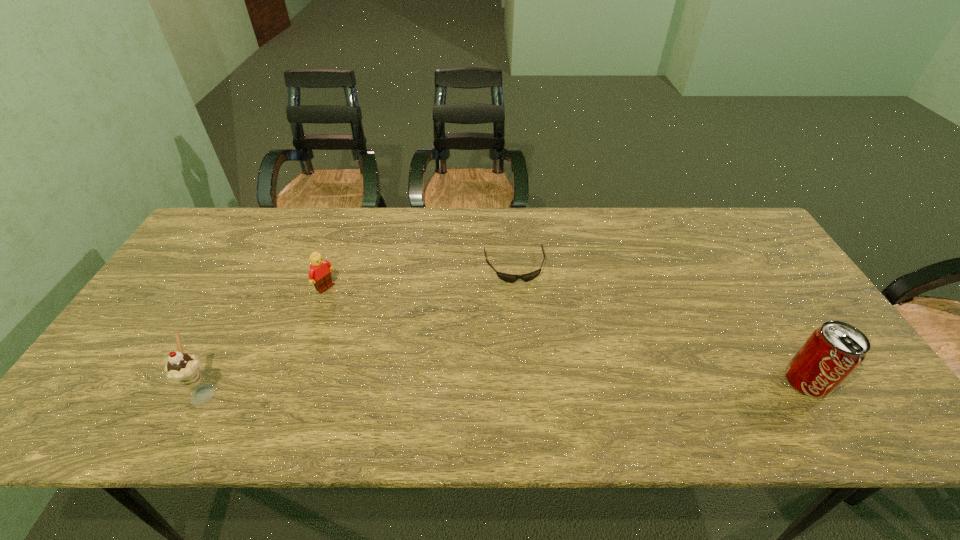
Where is `unoccupied position between the rightmost object and the second shortest object`? The width and height of the screenshot is (960, 540). unoccupied position between the rightmost object and the second shortest object is located at coordinates (566, 334).

Find the location of `free point between the shortest object and the Lego`. free point between the shortest object and the Lego is located at coordinates (420, 277).

This screenshot has height=540, width=960. I want to click on vacant space that's between the second object from left to right and the rightmost object, so click(x=566, y=334).

Image resolution: width=960 pixels, height=540 pixels. Find the location of `unoccupied area between the sunglasses and the pop soda`. unoccupied area between the sunglasses and the pop soda is located at coordinates (660, 324).

Select which object is the second closest to the icecream. Please provide its 2D coordinates. Your answer should be formatted as a tuple, i.e. [(x, y)], where the tuple contains the x and y coordinates of a point satisfying the conditions above.

[(510, 278)]

Select which object appears as the second closest to the Lego. Please provide its 2D coordinates. Your answer should be formatted as a tuple, i.e. [(x, y)], where the tuple contains the x and y coordinates of a point satisfying the conditions above.

[(510, 278)]

At what (x,y) coordinates should I click in order to perform the action: click on free space that satisfies the following two spatial constraints: 1. on the front side of the pop soda; 2. on the right side of the Lego. Please return your answer as a coordinate pair (x, y). Looking at the image, I should click on (293, 381).

Find the location of a particular element. vacant area that satisfies the following two spatial constraints: 1. on the back side of the icecream; 2. on the right side of the sunglasses is located at coordinates (269, 267).